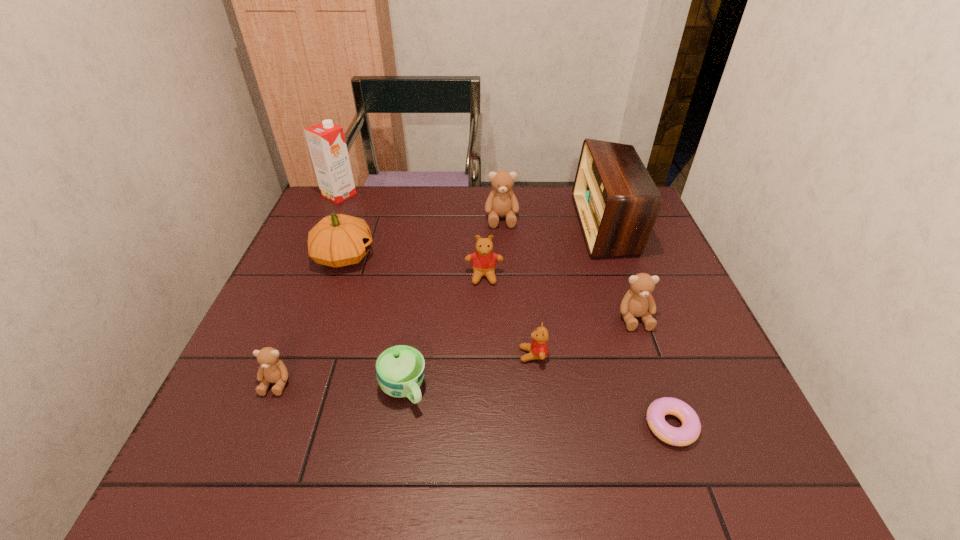
The height and width of the screenshot is (540, 960). I want to click on the tallest object, so click(326, 141).

The width and height of the screenshot is (960, 540). Find the location of `radio receiver`. radio receiver is located at coordinates (617, 202).

Find the location of a particular element. the second brown teddy bear from right to left is located at coordinates (501, 202).

Where is `the farthest teddy bear`? The image size is (960, 540). the farthest teddy bear is located at coordinates (501, 202).

Where is `gourd`? This screenshot has height=540, width=960. gourd is located at coordinates (338, 240).

Image resolution: width=960 pixels, height=540 pixels. Find the location of `the left red teddy bear`. the left red teddy bear is located at coordinates (483, 260).

Locate an element on the screen. This screenshot has height=540, width=960. the bigger red teddy bear is located at coordinates (483, 260).

Where is `the sixth farthest object`? This screenshot has height=540, width=960. the sixth farthest object is located at coordinates (638, 301).

Identify the location of the rightmost teddy bear. (638, 301).

Identify the location of the nearer red teddy bear. [x=538, y=348].